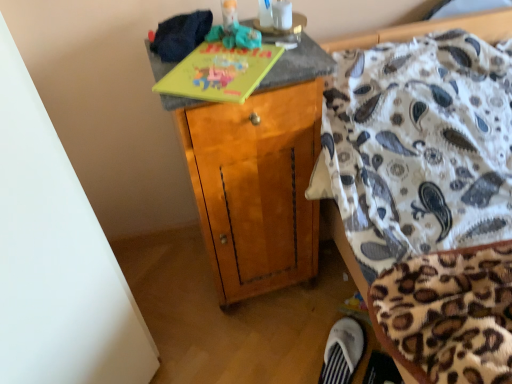
This screenshot has width=512, height=384. In order to click on blank space to the left of rubberized green toy at upper center in this screenshot , I will do pyautogui.click(x=181, y=55).